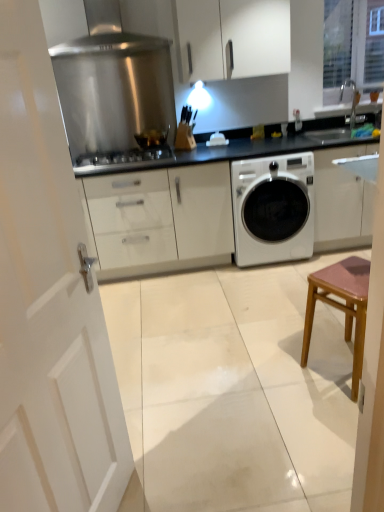
Question: Considering the relative sizes of stainless steel gas stove at center and stainless steel exhaust hood at upper center in the image provided, is stainless steel gas stove at center bigger than stainless steel exhaust hood at upper center?

Choices:
 (A) no
 (B) yes

Answer: (A)

Question: Considering the relative sizes of stainless steel gas stove at center and stainless steel exhaust hood at upper center in the image provided, is stainless steel gas stove at center thinner than stainless steel exhaust hood at upper center?

Choices:
 (A) no
 (B) yes

Answer: (A)

Question: Considering the relative sizes of stainless steel gas stove at center and stainless steel exhaust hood at upper center in the image provided, is stainless steel gas stove at center wider than stainless steel exhaust hood at upper center?

Choices:
 (A) yes
 (B) no

Answer: (A)

Question: Does stainless steel gas stove at center contain stainless steel exhaust hood at upper center?

Choices:
 (A) yes
 (B) no

Answer: (B)

Question: Is stainless steel gas stove at center at the left side of stainless steel exhaust hood at upper center?

Choices:
 (A) yes
 (B) no

Answer: (B)

Question: Based on their sizes in the image, would you say white wooden door at left is bigger or smaller than stainless steel exhaust hood at upper center?

Choices:
 (A) big
 (B) small

Answer: (A)

Question: In terms of height, does white wooden door at left look taller or shorter compared to stainless steel exhaust hood at upper center?

Choices:
 (A) short
 (B) tall

Answer: (B)

Question: Is white wooden door at left inside the boundaries of stainless steel exhaust hood at upper center, or outside?

Choices:
 (A) inside
 (B) outside

Answer: (B)

Question: Looking at their shapes, would you say white wooden door at left is wider or thinner than stainless steel exhaust hood at upper center?

Choices:
 (A) thin
 (B) wide

Answer: (A)

Question: Looking at the image, does translucent glass cup at center seem bigger or smaller compared to clear glass window at upper right?

Choices:
 (A) small
 (B) big

Answer: (A)

Question: Which is correct: translucent glass cup at center is inside clear glass window at upper right, or outside of it?

Choices:
 (A) inside
 (B) outside

Answer: (B)

Question: From the image's perspective, is translucent glass cup at center positioned above or below clear glass window at upper right?

Choices:
 (A) below
 (B) above

Answer: (A)

Question: Is translucent glass cup at center in front of or behind clear glass window at upper right in the image?

Choices:
 (A) front
 (B) behind

Answer: (A)

Question: Visually, is white wooden door at left positioned to the left or to the right of clear glass window at upper right?

Choices:
 (A) right
 (B) left

Answer: (B)

Question: Is point (x=34, y=206) closer or farther from the camera than point (x=370, y=88)?

Choices:
 (A) closer
 (B) farther

Answer: (A)